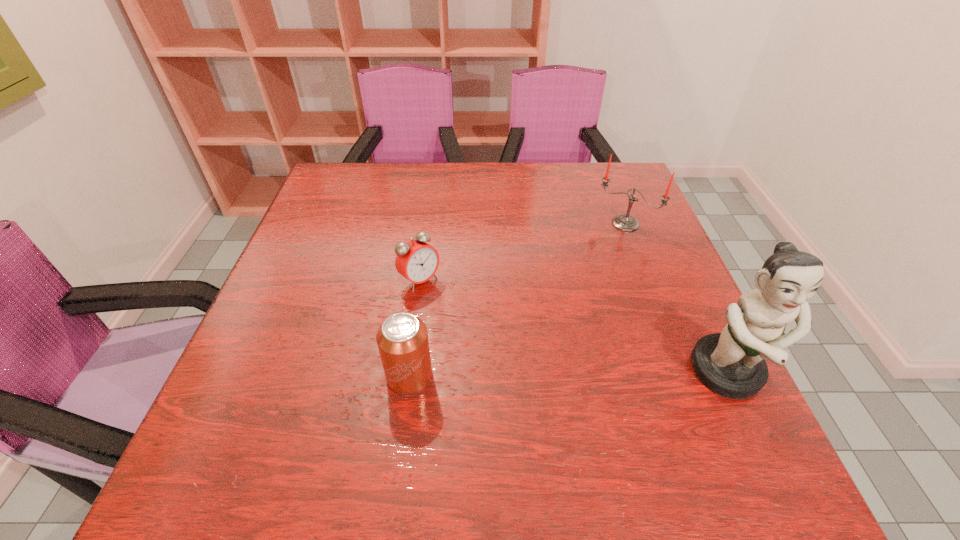
This screenshot has height=540, width=960. What are the coordinates of `the second shortest object` in the screenshot? It's located at (402, 339).

Image resolution: width=960 pixels, height=540 pixels. I want to click on figurine, so click(732, 364).

The height and width of the screenshot is (540, 960). In order to click on the farthest object in this screenshot , I will do `click(624, 222)`.

I want to click on candle, so click(624, 222).

The image size is (960, 540). I want to click on alarm clock, so click(417, 261).

Locate an element on the screen. This screenshot has height=540, width=960. the second farthest object is located at coordinates (417, 261).

The image size is (960, 540). What are the coordinates of `vacant space located on the back of the third tallest object` in the screenshot? It's located at (420, 301).

The image size is (960, 540). Find the location of `vacant region located on the front-facing side of the second tallest object`. vacant region located on the front-facing side of the second tallest object is located at coordinates (606, 247).

Identify the location of free location located 0.200m on the front-facing side of the second tallest object. This screenshot has height=540, width=960. (584, 280).

This screenshot has width=960, height=540. In order to click on free region located on the front-facing side of the second tallest object in this screenshot , I will do `click(603, 251)`.